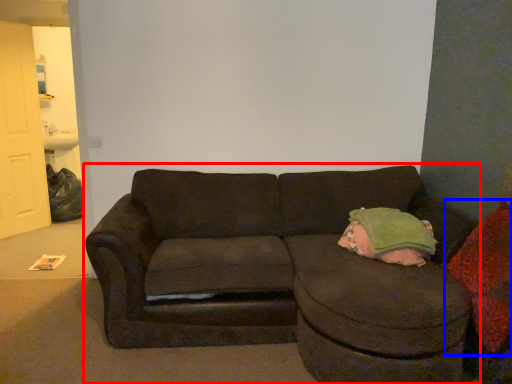
Question: Which object is closer to the camera taking this photo, studio couch (highlighted by a red box) or throw pillow (highlighted by a blue box)?

Choices:
 (A) studio couch
 (B) throw pillow

Answer: (A)